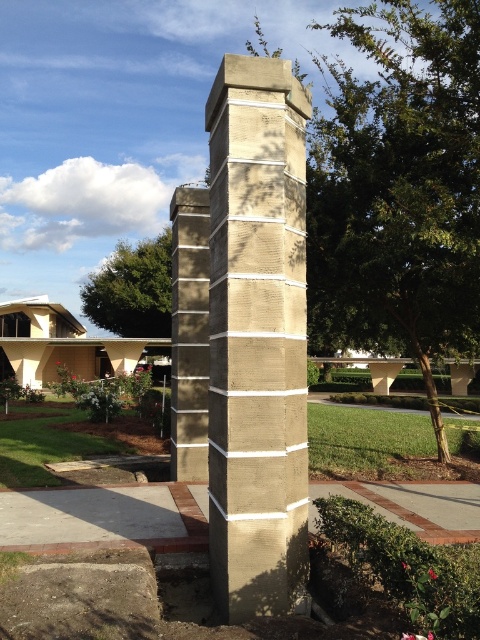
Between sandy concrete column at center and gray concrete at lower left, which one has less height?

Standing shorter between the two is gray concrete at lower left.

Can you confirm if sandy concrete column at center is positioned above gray concrete at lower left?

Yes.

Identify the location of sandy concrete column at center. This screenshot has height=640, width=480. (190, 333).

Looking at this image, is concrete textured column at center shorter than gray concrete at lower left?

Incorrect, concrete textured column at center's height does not fall short of gray concrete at lower left's.

Between concrete textured column at center and gray concrete at lower left, which one appears on the right side from the viewer's perspective?

From the viewer's perspective, concrete textured column at center appears more on the right side.

Does point (253, 474) lie in front of point (9, 493)?

Yes.

At what (x,y) coordinates should I click in order to perform the action: click on concrete textured column at center. Please return your answer as a coordinate pair (x, y). Image resolution: width=480 pixels, height=640 pixels. Looking at the image, I should click on (256, 337).

Between concrete textured column at center and sandy concrete column at center, which one has less height?

sandy concrete column at center

Between point (299, 170) and point (177, 474), which one is positioned in front?

Point (299, 170) is in front.

Is point (252, 154) farther from camera compared to point (177, 285)?

No, it is not.

Where is `concrete textured column at center`? concrete textured column at center is located at coordinates (256, 337).